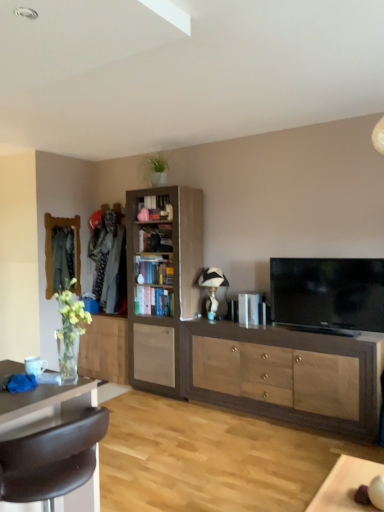
Describe the element at coordinates (161, 281) in the screenshot. I see `light brown wood bookshelf at center, placed as the 2th cabinetry when sorted from right to left` at that location.

At what (x,y) coordinates should I click in order to perform the action: click on light brown wood cabinet at center, marked as the third cabinetry in a right-to-left arrangement. Please return your answer as a coordinate pair (x, y). The height and width of the screenshot is (512, 384). Looking at the image, I should click on (105, 349).

Identify the location of matte wood cabinet at center, positioned as the 1th cabinetry in right-to-left order. The image size is (384, 512). coord(285,374).

This screenshot has height=512, width=384. I want to click on matte wooden mirror at left, so click(51, 251).

How far apart are light brown wood bookshelf at center, acting as the second cabinetry starting from the left, and flat screen tv at right?

light brown wood bookshelf at center, acting as the second cabinetry starting from the left, and flat screen tv at right are 1.34 meters apart.

Is light brown wood bookshelf at center, placed as the 2th cabinetry when sorted from right to left, looking in the opposite direction of flat screen tv at right?

That's not correct — light brown wood bookshelf at center, placed as the 2th cabinetry when sorted from right to left, is not looking away from flat screen tv at right.

Is light brown wood bookshelf at center, acting as the second cabinetry starting from the left, positioned far away from flat screen tv at right?

That's right, there is a large distance between light brown wood bookshelf at center, acting as the second cabinetry starting from the left, and flat screen tv at right.

Considering the relative positions of light brown wood bookshelf at center, acting as the second cabinetry starting from the left, and flat screen tv at right in the image provided, is light brown wood bookshelf at center, acting as the second cabinetry starting from the left, to the right of flat screen tv at right from the viewer's perspective?

No.

Which is more to the right, light brown wood cabinet at center, marked as the third cabinetry in a right-to-left arrangement, or brown leather chair at lower left?

From the viewer's perspective, brown leather chair at lower left appears more on the right side.

Consider the image. Is light brown wood cabinet at center, marked as the third cabinetry in a right-to-left arrangement, bigger than brown leather chair at lower left?

No.

Is the surface of light brown wood cabinet at center, marked as the third cabinetry in a right-to-left arrangement, in direct contact with brown leather chair at lower left?

No, light brown wood cabinet at center, marked as the third cabinetry in a right-to-left arrangement, is not with brown leather chair at lower left.

From a real-world perspective, is flat screen tv at right physically below matte wooden mirror at left?

Yes, from a real-world perspective, flat screen tv at right is beneath matte wooden mirror at left.

In the scene shown: Is the surface of flat screen tv at right in direct contact with matte wooden mirror at left?

They are not placed beside each other.

Is flat screen tv at right aimed at matte wooden mirror at left?

No, flat screen tv at right is not turned towards matte wooden mirror at left.

You are a GUI agent. You are given a task and a screenshot of the screen. Output one action in this format:
    pyautogui.click(x=<x>, y=<y>)
    Task: Click on the television on the right of matte wooden mirror at left
    
    Given the screenshot: What is the action you would take?
    pyautogui.click(x=328, y=293)

From the image's perspective, is wooden bookshelf at center, which ranks as the second shelf in bottom-to-top order, above light brown wood bookshelf at center, acting as the second cabinetry starting from the left?

Yes, from the image's perspective, wooden bookshelf at center, which ranks as the second shelf in bottom-to-top order, is on top of light brown wood bookshelf at center, acting as the second cabinetry starting from the left.

How different are the orientations of wooden bookshelf at center, which appears as the 1th shelf when viewed from the top, and light brown wood bookshelf at center, placed as the 2th cabinetry when sorted from right to left, in degrees?

0.98 degrees.

Considering the positions of objects wooden bookshelf at center, which appears as the 1th shelf when viewed from the top, and light brown wood bookshelf at center, acting as the second cabinetry starting from the left, in the image provided, who is more to the left, wooden bookshelf at center, which appears as the 1th shelf when viewed from the top, or light brown wood bookshelf at center, acting as the second cabinetry starting from the left,?

wooden bookshelf at center, which appears as the 1th shelf when viewed from the top.

Consider the image. Based on their positions, is flat screen tv at right located to the left or right of matte wood cabinet at center, which appears as the 3th cabinetry when viewed from the left?

flat screen tv at right is positioned on matte wood cabinet at center, which appears as the 3th cabinetry when viewed from the left,'s right side.

From the image's perspective, which one is positioned higher, flat screen tv at right or matte wood cabinet at center, which appears as the 3th cabinetry when viewed from the left?

From the image's view, flat screen tv at right is above.

Does point (309, 287) lie behind point (200, 392)?

No.

Does flat screen tv at right turn towards matte wood cabinet at center, positioned as the 1th cabinetry in right-to-left order?

No, flat screen tv at right is not turned towards matte wood cabinet at center, positioned as the 1th cabinetry in right-to-left order.

Consider the image. Would you say wooden bookshelf at center, which ranks as the second shelf in bottom-to-top order, contains brown leather chair at lower left?

No, brown leather chair at lower left is not inside wooden bookshelf at center, which ranks as the second shelf in bottom-to-top order.

From a real-world perspective, which is physically below, wooden bookshelf at center, which ranks as the second shelf in bottom-to-top order, or brown leather chair at lower left?

brown leather chair at lower left, from a real-world perspective.

Between point (151, 265) and point (18, 456), which one is positioned behind?

The point (151, 265) is behind.

What's the angular difference between wooden bookshelf at center, which ranks as the second shelf in bottom-to-top order, and brown leather chair at lower left's facing directions?

The angle between the facing direction of wooden bookshelf at center, which ranks as the second shelf in bottom-to-top order, and the facing direction of brown leather chair at lower left is 90.1 degrees.

Can you confirm if brown leather chair at lower left is positioned to the right of matte wood cabinet at center, positioned as the 1th cabinetry in right-to-left order?

No, brown leather chair at lower left is not to the right of matte wood cabinet at center, positioned as the 1th cabinetry in right-to-left order.

Which is in front, point (27, 464) or point (337, 405)?

Point (27, 464)

Does brown leather chair at lower left have a larger size compared to matte wood cabinet at center, which appears as the 3th cabinetry when viewed from the left?

No, brown leather chair at lower left is not bigger than matte wood cabinet at center, which appears as the 3th cabinetry when viewed from the left.

Which is behind, brown leather chair at lower left or matte wood cabinet at center, positioned as the 1th cabinetry in right-to-left order?

matte wood cabinet at center, positioned as the 1th cabinetry in right-to-left order.

From the flat screen tv at right, count the 2nd cabinetry to the left and point to it. Please provide its 2D coordinates.

[(161, 281)]

Locate an element on the screen. The width and height of the screenshot is (384, 512). chair below the light brown wood cabinet at center, marked as the third cabinetry in a right-to-left arrangement (from the image's perspective) is located at coordinates (51, 459).

Looking at the image, which one is located closer to wooden bookshelf at center, which appears as the 1th shelf when viewed from the top, matte wooden mirror at left or flat screen tv at right?

matte wooden mirror at left.

Estimate the real-world distances between objects in this image. Which object is further from light brown wood bookshelf at center, placed as the 2th cabinetry when sorted from right to left, matte wooden mirror at left or matte wood cabinet at center, positioned as the 1th cabinetry in right-to-left order?

matte wooden mirror at left lies further to light brown wood bookshelf at center, placed as the 2th cabinetry when sorted from right to left, than the other object.

Based on their spatial positions, is brown leather chair at lower left or light brown wood bookshelf at center, placed as the 2th cabinetry when sorted from right to left, closer to matte wooden mirror at left?

Among the two, light brown wood bookshelf at center, placed as the 2th cabinetry when sorted from right to left, is located nearer to matte wooden mirror at left.

Looking at the image, which one is located further to matte wood cabinet at center, which appears as the 3th cabinetry when viewed from the left, wooden bookshelf at center, which ranks as the second shelf in bottom-to-top order, or matte wooden mirror at left?

The object further to matte wood cabinet at center, which appears as the 3th cabinetry when viewed from the left, is matte wooden mirror at left.

Looking at this image, looking at the image, which one is located further to wooden bookshelf at center, which appears as the 1th shelf when viewed from the top, matte wood cabinet at center, positioned as the 1th cabinetry in right-to-left order, or light brown wood cabinet at center, marked as the third cabinetry in a right-to-left arrangement?

matte wood cabinet at center, positioned as the 1th cabinetry in right-to-left order, is positioned further to the anchor wooden bookshelf at center, which appears as the 1th shelf when viewed from the top.

From the image, which object appears to be farther from light brown wood cabinet at center, which is the first cabinetry in left-to-right order, matte wood cabinet at center, which appears as the 3th cabinetry when viewed from the left, or wooden bookshelf at center, which ranks as the second shelf in bottom-to-top order?

matte wood cabinet at center, which appears as the 3th cabinetry when viewed from the left, is positioned further to the anchor light brown wood cabinet at center, which is the first cabinetry in left-to-right order.

Estimate the real-world distances between objects in this image. Which object is closer to matte wooden mirror at left, light brown wood bookshelf at center, placed as the 2th cabinetry when sorted from right to left, or light brown wood cabinet at center, marked as the third cabinetry in a right-to-left arrangement?

light brown wood cabinet at center, marked as the third cabinetry in a right-to-left arrangement, is positioned closer to the anchor matte wooden mirror at left.

When comparing their distances from brown leather chair at lower left, does flat screen tv at right or matte wooden mirror at left seem closer?

flat screen tv at right is closer to brown leather chair at lower left.

Where is `shelf between wooden bookshelf at center, which ranks as the second shelf in bottom-to-top order, and light brown wood cabinet at center, marked as the third cabinetry in a right-to-left arrangement, in the up-down direction`? Image resolution: width=384 pixels, height=512 pixels. shelf between wooden bookshelf at center, which ranks as the second shelf in bottom-to-top order, and light brown wood cabinet at center, marked as the third cabinetry in a right-to-left arrangement, in the up-down direction is located at coordinates (154, 301).

Where is `cabinetry between matte wooden mirror at left and wooden bookshelf at center, which is the 1th shelf from bottom to top`? The width and height of the screenshot is (384, 512). cabinetry between matte wooden mirror at left and wooden bookshelf at center, which is the 1th shelf from bottom to top is located at coordinates (105, 349).

The height and width of the screenshot is (512, 384). Find the location of `shelf between light brown wood bookshelf at center, placed as the 2th cabinetry when sorted from right to left, and wooden bookshelf at center, which ranks as the second shelf in bottom-to-top order, from front to back`. shelf between light brown wood bookshelf at center, placed as the 2th cabinetry when sorted from right to left, and wooden bookshelf at center, which ranks as the second shelf in bottom-to-top order, from front to back is located at coordinates (154, 301).

Identify the location of television between brown leather chair at lower left and wooden bookshelf at center, which ranks as the second shelf in bottom-to-top order, along the z-axis. The image size is (384, 512). (328, 293).